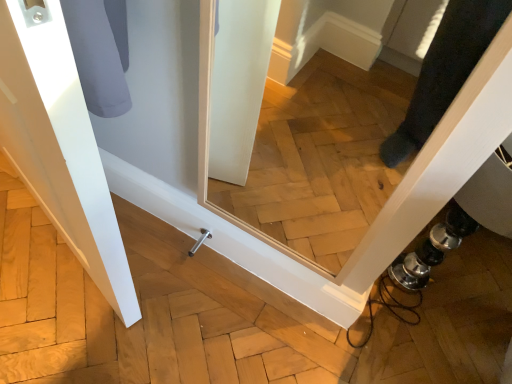
This screenshot has height=384, width=512. Find the location of `unoccupied area in front of satin nickel door handle at lower center`. unoccupied area in front of satin nickel door handle at lower center is located at coordinates (178, 326).